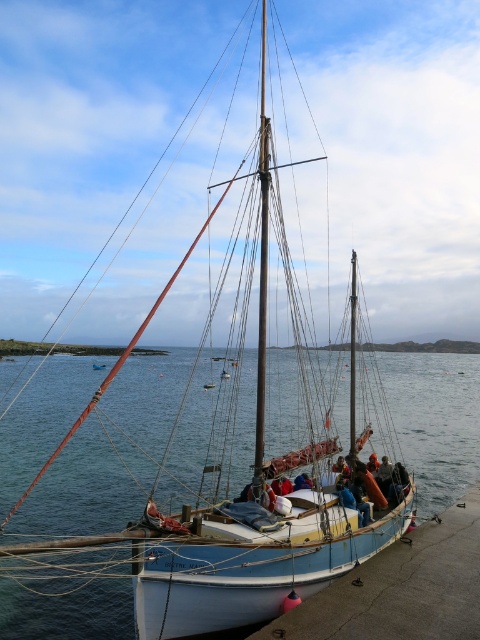
Question: Which of the following is the closest to the observer?

Choices:
 (A) (43, 426)
 (B) (255, 493)

Answer: (B)

Question: Which point appears closest to the camera in this image?

Choices:
 (A) (364, 353)
 (B) (261, 339)

Answer: (B)

Question: Does blue water at center appear over polished silver mast at center?

Choices:
 (A) no
 (B) yes

Answer: (A)

Question: Where is blue water at center located in relation to polished silver mast at center in the image?

Choices:
 (A) below
 (B) above

Answer: (A)

Question: Which of the following is the closest to the observer?

Choices:
 (A) blue water at center
 (B) polished silver mast at center

Answer: (B)

Question: Observing the image, what is the correct spatial positioning of blue water at center in reference to polished silver mast at center?

Choices:
 (A) left
 (B) right

Answer: (A)